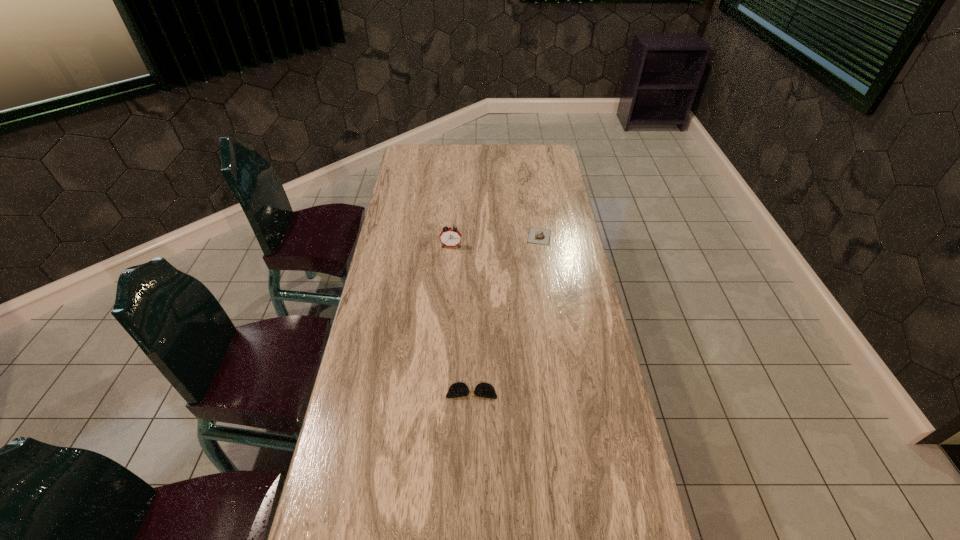
I want to click on free space at the left edge of the desktop, so tap(429, 200).

This screenshot has width=960, height=540. I want to click on vacant space at the right edge of the desktop, so click(571, 504).

Where is `vacant space at the far left corner of the desktop`? The width and height of the screenshot is (960, 540). vacant space at the far left corner of the desktop is located at coordinates (399, 167).

The width and height of the screenshot is (960, 540). What are the coordinates of `vacant point at the far right corner` in the screenshot? It's located at (533, 151).

Locate an element on the screen. free area in between the nearest object and the garlic is located at coordinates (505, 314).

Locate an element on the screen. Image resolution: width=960 pixels, height=540 pixels. vacant area that lies between the second shortest object and the alarm clock is located at coordinates (495, 241).

At what (x,y) coordinates should I click in order to perform the action: click on vacant space that is in between the nearest object and the second tallest object. Please return your answer as a coordinate pair (x, y). The image size is (960, 540). Looking at the image, I should click on (505, 314).

Locate an element on the screen. The width and height of the screenshot is (960, 540). empty space between the second tallest object and the alarm clock is located at coordinates 495,241.

Where is `free area in between the shortest object and the tallest object`? This screenshot has height=540, width=960. free area in between the shortest object and the tallest object is located at coordinates (462, 319).

You are a GUI agent. You are given a task and a screenshot of the screen. Output one action in this format:
    pyautogui.click(x=<x>, y=<y>)
    Task: Click on the free space between the nearest object and the tallest object
    Image resolution: width=960 pixels, height=540 pixels.
    Given the screenshot: What is the action you would take?
    pyautogui.click(x=462, y=319)